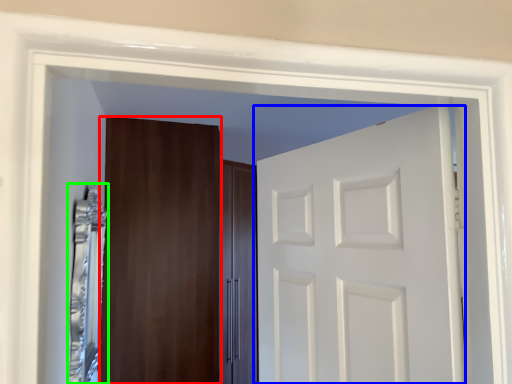
Question: Which object is positioned closest to door (highlighted by a red box)? Select from door (highlighted by a blue box) and mirror (highlighted by a green box).

Choices:
 (A) door
 (B) mirror

Answer: (B)